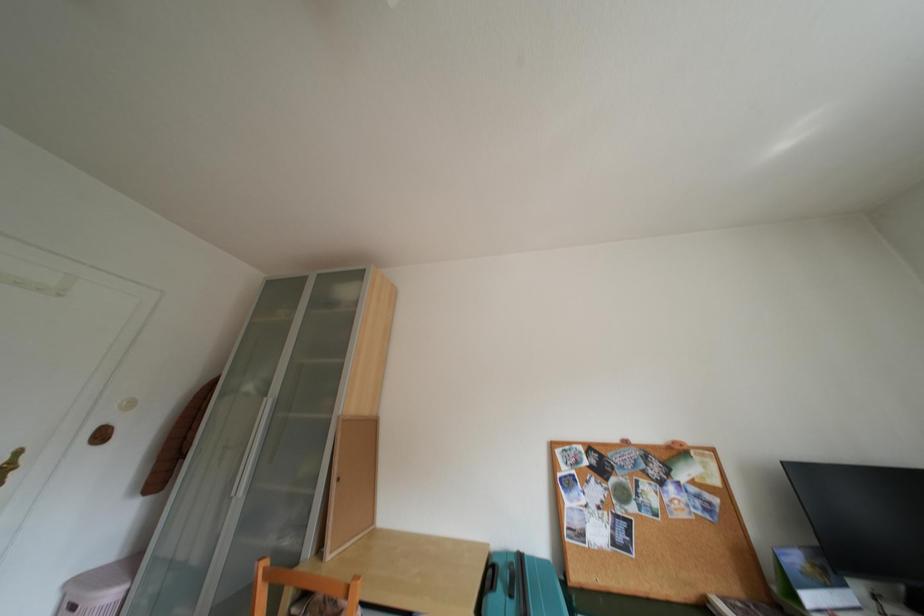
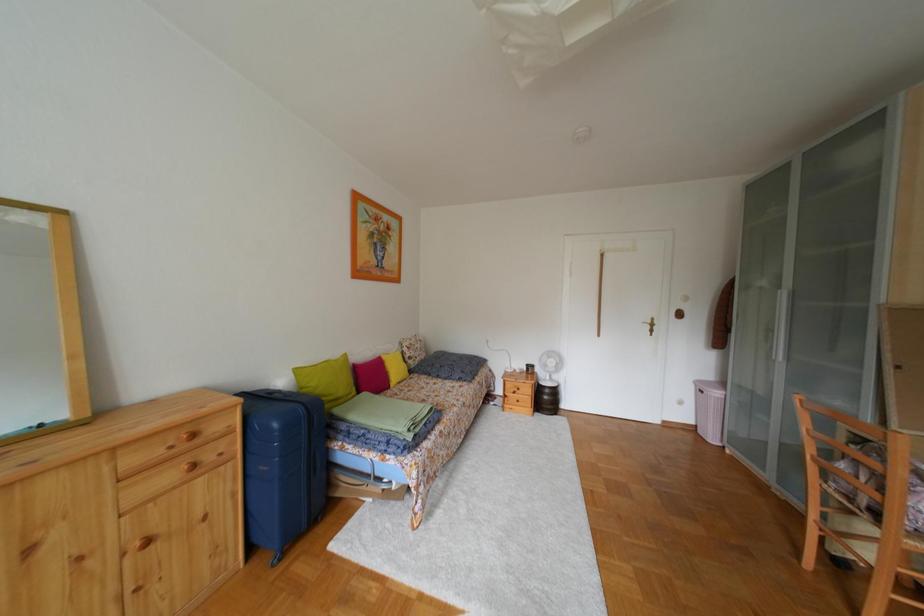
Question: The first image is from the beginning of the video and the second image is from the end. How did the camera likely rotate when shooting the video?

Choices:
 (A) Left
 (B) Right
 (C) Up
 (D) Down

Answer: (A)